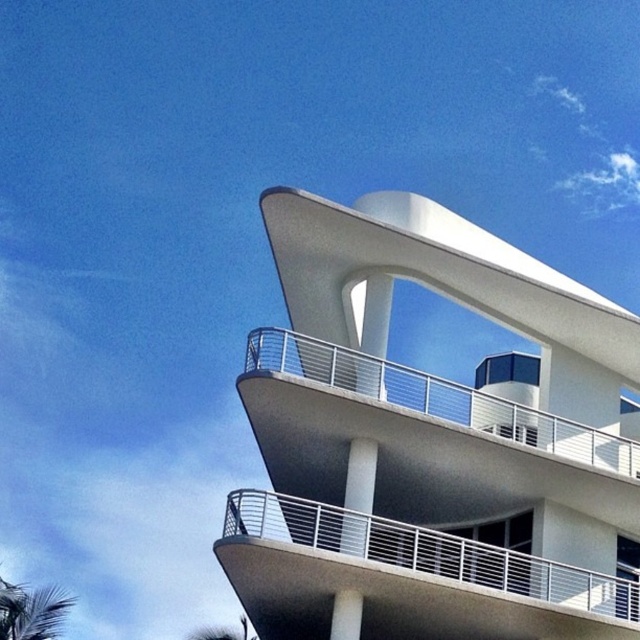
Can you confirm if white smooth balcony at upper right is positioned to the left of white metal railing at center?

No, white smooth balcony at upper right is not to the left of white metal railing at center.

Who is taller, white smooth balcony at upper right or white metal railing at center?

With more height is white smooth balcony at upper right.

Is point (340, 330) farther from camera compared to point (456, 592)?

Yes, it is.

The width and height of the screenshot is (640, 640). What are the coordinates of `white smooth balcony at upper right` in the screenshot? It's located at (429, 444).